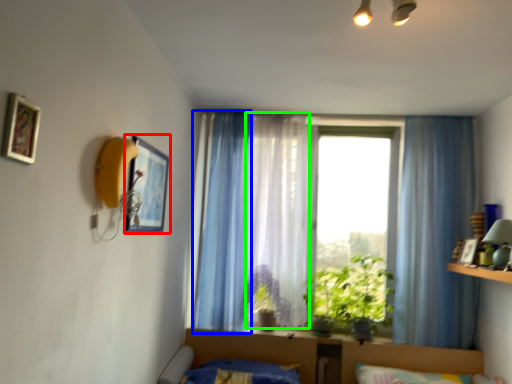
Question: Which is nearer to the picture frame (highlighted by a red box)? curtain (highlighted by a blue box) or curtain (highlighted by a green box).

Choices:
 (A) curtain
 (B) curtain

Answer: (A)